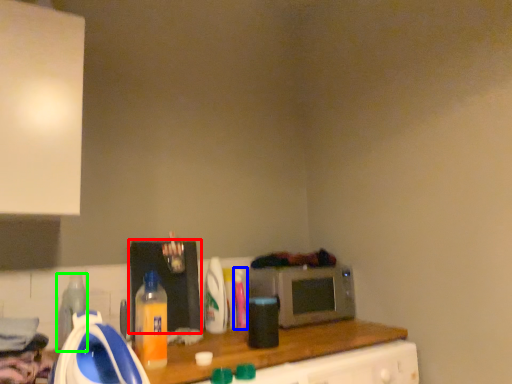
Question: Which object is the closest to the appliance (highlighted by a red box)? Choose among these: bottle (highlighted by a blue box) or bottle (highlighted by a green box).

Choices:
 (A) bottle
 (B) bottle

Answer: (A)